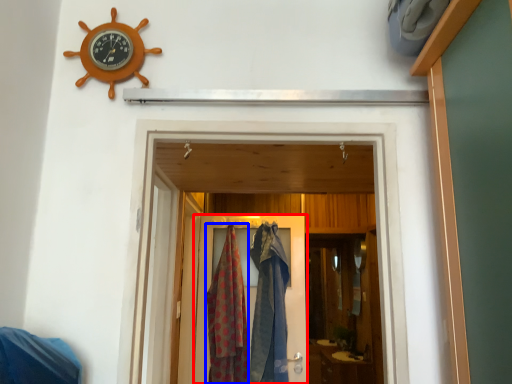
Question: Which of the following is the closest to the observer, door (highlighted by a red box) or clothing (highlighted by a blue box)?

Choices:
 (A) door
 (B) clothing

Answer: (B)